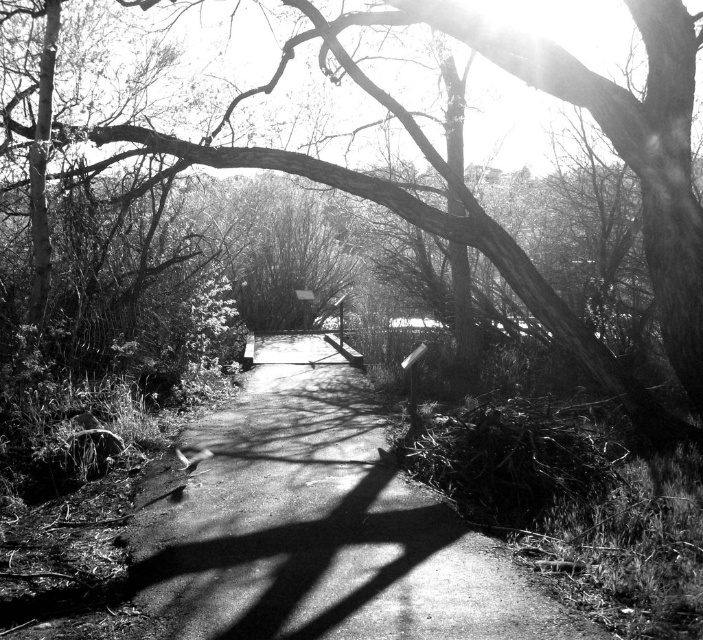
Question: Is smooth concrete path at center wider than smooth bark tree at center?

Choices:
 (A) yes
 (B) no

Answer: (B)

Question: Among these objects, which one is farthest from the camera?

Choices:
 (A) smooth concrete path at center
 (B) smooth bark tree at center

Answer: (B)

Question: Is smooth concrete path at center thinner than smooth bark tree at center?

Choices:
 (A) no
 (B) yes

Answer: (B)

Question: Can you confirm if smooth concrete path at center is bigger than smooth bark tree at center?

Choices:
 (A) yes
 (B) no

Answer: (B)